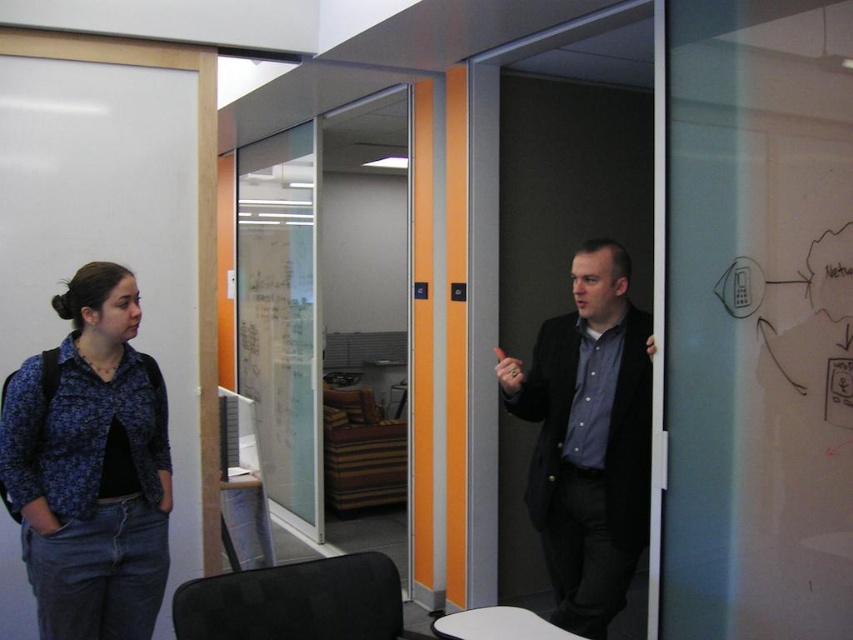
You are trying to determine if the transparent glass door at center can be seen over the top of the blue floral shirt at left. Based on their heights, can you see the door through the shirt?

The transparent glass door at center is taller than the blue floral shirt at left, so yes, you can see the door over the top of the blue floral shirt at left.